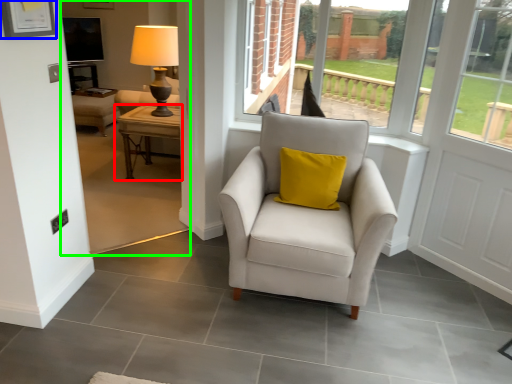
Question: Which is nearer to the table (highlighted by a red box)? picture frame (highlighted by a blue box) or backyard (highlighted by a green box).

Choices:
 (A) picture frame
 (B) backyard

Answer: (B)